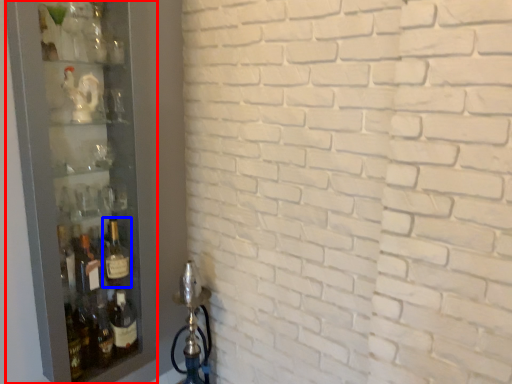
Question: Which point is further to the camera, glass door (highlighted by a red box) or bottle (highlighted by a blue box)?

Choices:
 (A) glass door
 (B) bottle

Answer: (B)